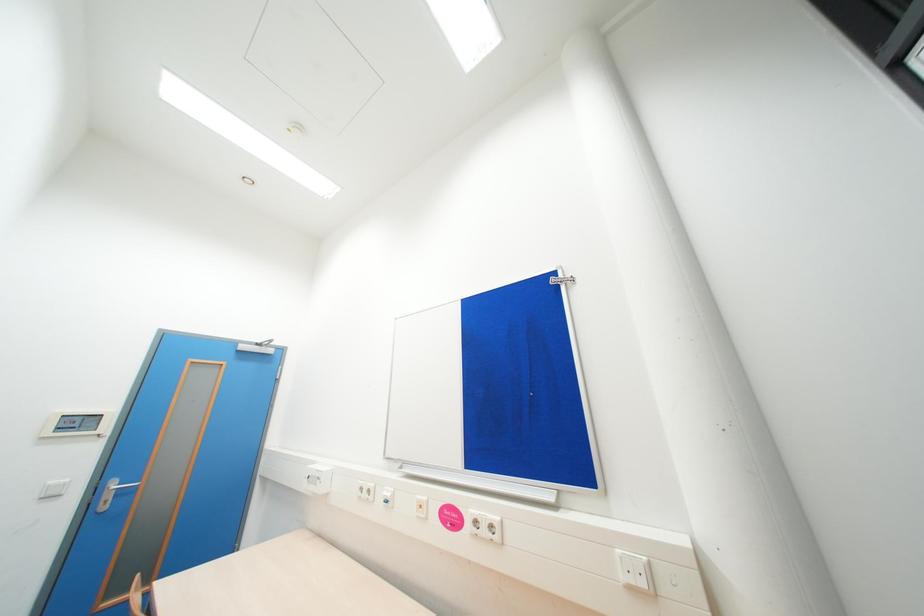
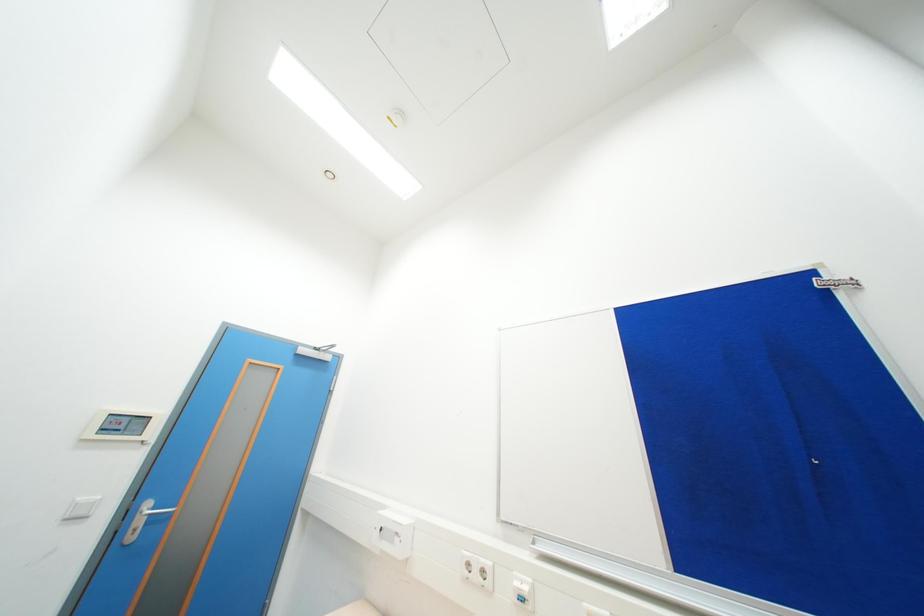
Question: The images are taken continuously from a first-person perspective. In which direction is your viewpoint rotating?

Choices:
 (A) Left
 (B) Right
 (C) Up
 (D) Down

Answer: (C)